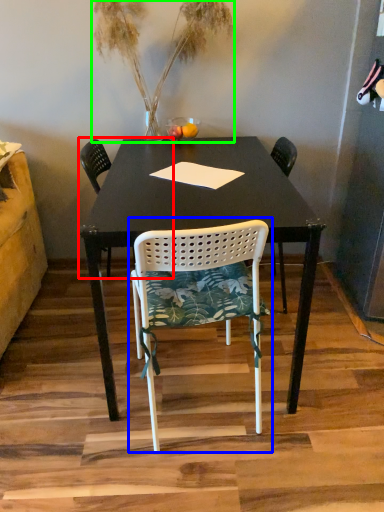
Question: Which is farther away from chair (highlighted by a red box)? chair (highlighted by a blue box) or houseplant (highlighted by a green box)?

Choices:
 (A) chair
 (B) houseplant

Answer: (A)